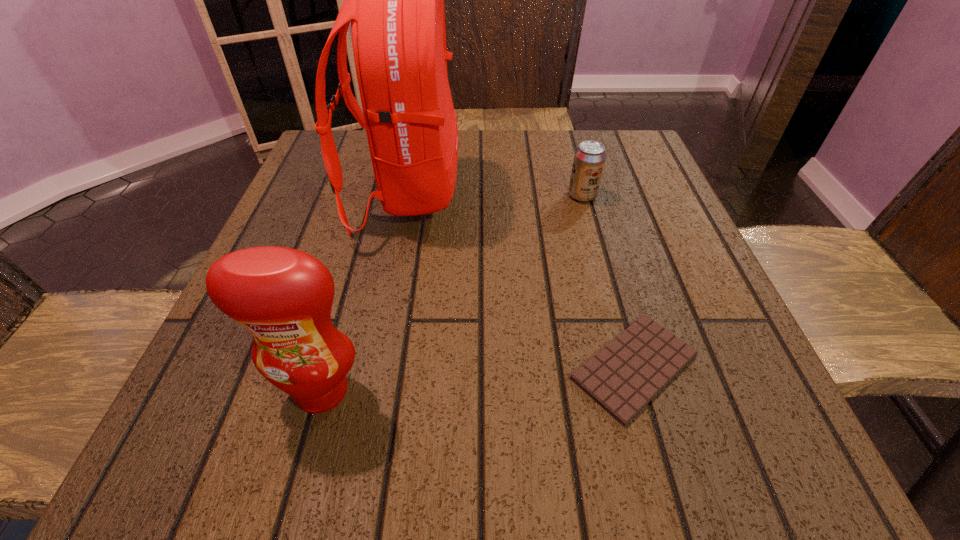
Where is `blank space that satisfies the following two spatial constraints: 1. on the back side of the beer can; 2. on the main compartment of the tallest object`? blank space that satisfies the following two spatial constraints: 1. on the back side of the beer can; 2. on the main compartment of the tallest object is located at coordinates (582, 193).

Locate an element on the screen. This screenshot has width=960, height=540. vacant point that satisfies the following two spatial constraints: 1. on the main compartment of the tallest object; 2. on the label side of the condiment is located at coordinates point(367,390).

You are a GUI agent. You are given a task and a screenshot of the screen. Output one action in this format:
    pyautogui.click(x=<x>, y=<y>)
    Task: Click on the vacant space that satisfies the following two spatial constraints: 1. on the front side of the beer can; 2. on the right side of the chocolate bar
    This screenshot has height=540, width=960.
    Given the screenshot: What is the action you would take?
    pyautogui.click(x=629, y=367)

Find the location of a particular element. Image resolution: width=960 pixels, height=540 pixels. free space that satisfies the following two spatial constraints: 1. on the main compartment of the backpack; 2. on the label side of the third shortest object is located at coordinates (367, 390).

You are a GUI agent. You are given a task and a screenshot of the screen. Output one action in this format:
    pyautogui.click(x=<x>, y=<y>)
    Task: Click on the free space that satisfies the following two spatial constraints: 1. on the main compartment of the backpack; 2. on the label side of the condiment
    This screenshot has height=540, width=960.
    Given the screenshot: What is the action you would take?
    pyautogui.click(x=367, y=390)

Identify the location of blank space that satisfies the following two spatial constraints: 1. on the main compartment of the tallest object; 2. on the back side of the third tallest object. (405, 195).

Image resolution: width=960 pixels, height=540 pixels. What are the coordinates of `vacant space that satisfies the following two spatial constraints: 1. on the main compartment of the shortest object; 2. on the left side of the backpack` in the screenshot? It's located at (372, 367).

Locate an element on the screen. The image size is (960, 540). vacant region that satisfies the following two spatial constraints: 1. on the main compartment of the third tallest object; 2. on the left side of the tallest object is located at coordinates pos(405,195).